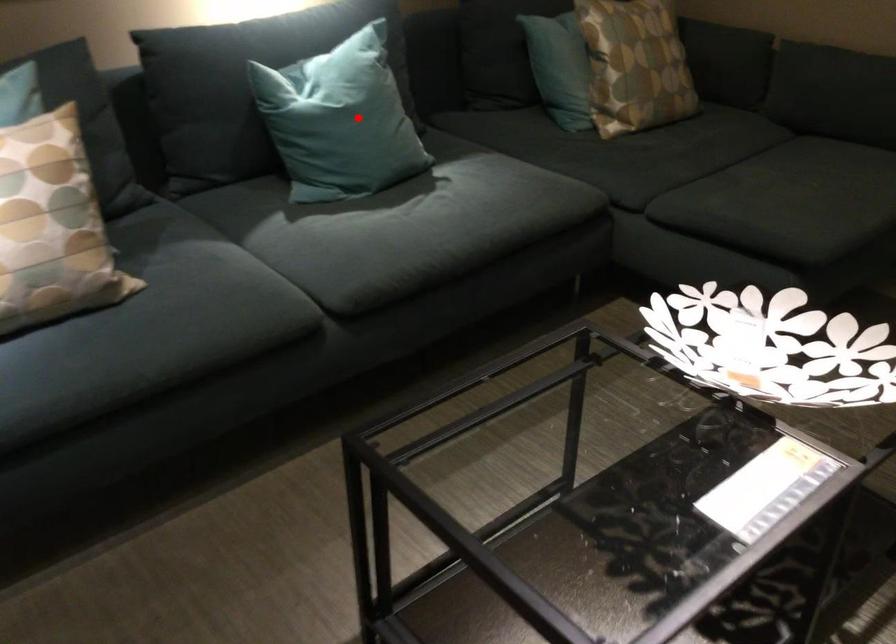
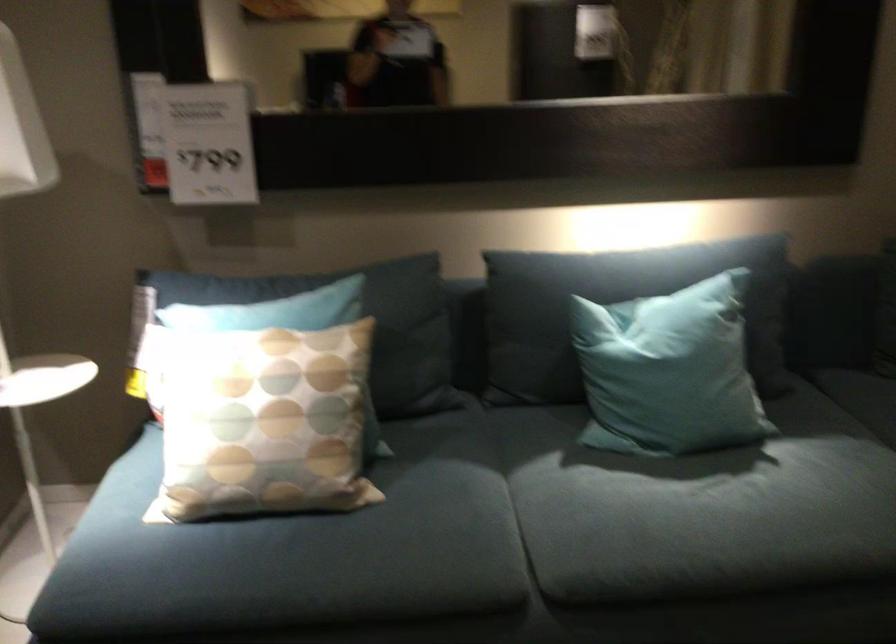
Question: I am providing you with two images of the same scene from different viewpoints. Image1 has a red point marked. In image2, the corresponding 3D location appears at what relative position? Reply with the corresponding letter.

Choices:
 (A) Closer
 (B) Farther

Answer: (A)